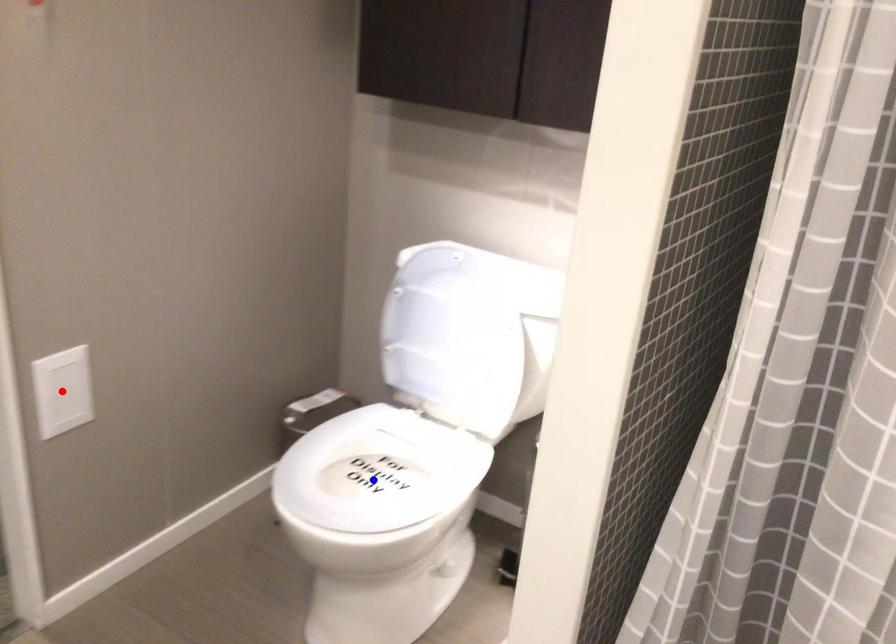
Question: Two points are marked on the image. Which point is closer to the camera?

Choices:
 (A) Blue point is closer.
 (B) Red point is closer.

Answer: (B)